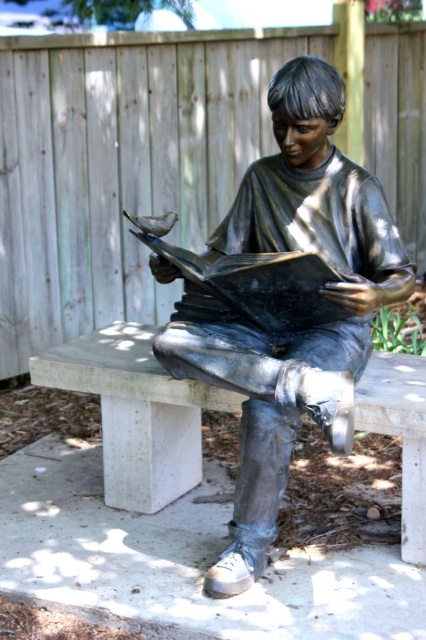
Question: From the image, what is the correct spatial relationship of shiny bronze statue at center in relation to concrete bench at center?

Choices:
 (A) right
 (B) left

Answer: (A)

Question: Does shiny bronze statue at center have a greater width compared to concrete bench at center?

Choices:
 (A) yes
 (B) no

Answer: (A)

Question: Where is shiny bronze statue at center located in relation to concrete bench at center in the image?

Choices:
 (A) right
 (B) left

Answer: (A)

Question: Among these points, which one is nearest to the camera?

Choices:
 (A) (425, 417)
 (B) (249, 557)

Answer: (A)